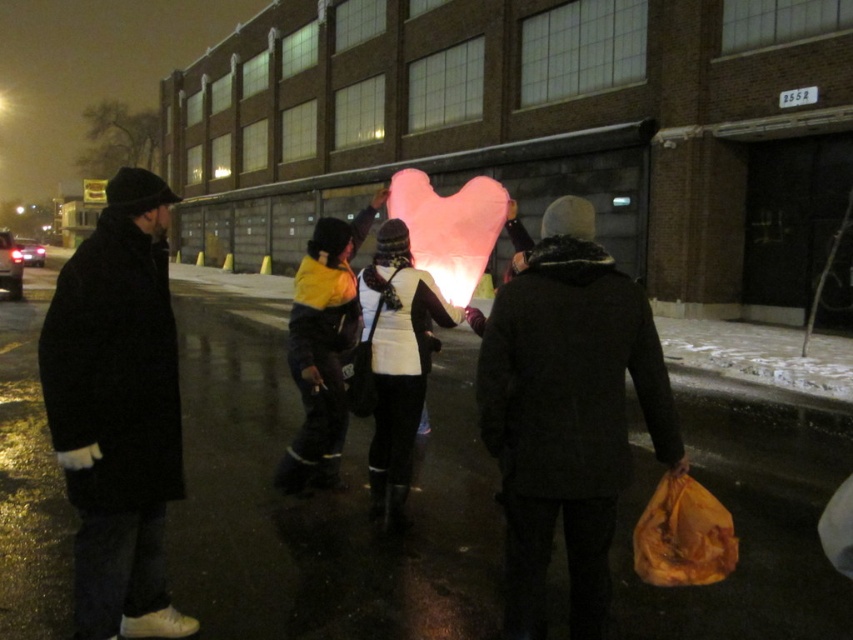
You are standing at the point with coordinates point [437,212] and want to walk to the point with coordinates point [550,244]. Is the destination point in front of or behind you?

The point [550,244] is in front of point [437,212], so the destination point is in front of you.

You are a photographer trying to capture a photo of the pink fluffy heart at center without including the black wool coat at left in the frame. Based on their positions, is this possible?

The black wool coat at left is to the left of the pink fluffy heart at center, so if you position yourself to the right side of the black wool coat at left, you can frame the shot to exclude it and focus solely on the pink fluffy heart at center.

Where is the black wool coat at left located in the image?

A: The black wool coat at left is located at point [117,410] in the image.